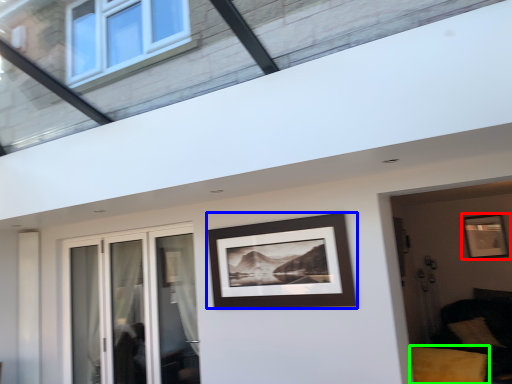
Question: Which object is positioned farthest from picture frame (highlighted by a red box)? Select from picture frame (highlighted by a blue box) and furniture (highlighted by a green box).

Choices:
 (A) picture frame
 (B) furniture

Answer: (A)